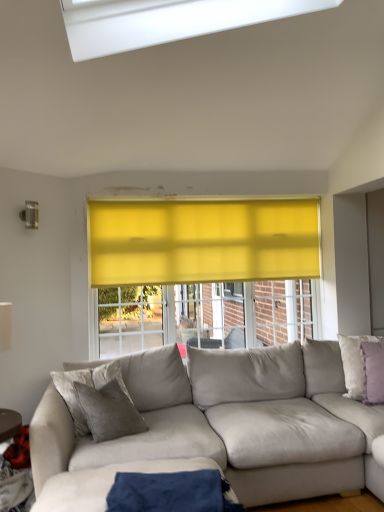
Question: From the image's perspective, is suede beige couch at lower right below white matte table lamp at left?

Choices:
 (A) yes
 (B) no

Answer: (A)

Question: Is suede beige couch at lower right oriented away from white matte table lamp at left?

Choices:
 (A) no
 (B) yes

Answer: (A)

Question: Is suede beige couch at lower right not near white matte table lamp at left?

Choices:
 (A) yes
 (B) no

Answer: (A)

Question: From the image's perspective, is suede beige couch at lower right over white matte table lamp at left?

Choices:
 (A) no
 (B) yes

Answer: (A)

Question: From a real-world perspective, is suede beige couch at lower right physically above white matte table lamp at left?

Choices:
 (A) yes
 (B) no

Answer: (B)

Question: From a real-world perspective, is white matte table lamp at left positioned above or below wooden textured table at lower left?

Choices:
 (A) below
 (B) above

Answer: (B)

Question: Is white matte table lamp at left situated inside wooden textured table at lower left or outside?

Choices:
 (A) inside
 (B) outside

Answer: (B)

Question: From their relative heights in the image, would you say white matte table lamp at left is taller or shorter than wooden textured table at lower left?

Choices:
 (A) short
 (B) tall

Answer: (A)

Question: Is point [x=6, y=347] closer or farther from the camera than point [x=28, y=444]?

Choices:
 (A) closer
 (B) farther

Answer: (B)

Question: In terms of height, does wooden textured table at lower left look taller or shorter compared to purple velvet pillow at right, the 1th pillow viewed from the front?

Choices:
 (A) tall
 (B) short

Answer: (A)

Question: From the image's perspective, is wooden textured table at lower left above or below purple velvet pillow at right, which is counted as the 2th pillow, starting from the back?

Choices:
 (A) above
 (B) below

Answer: (B)

Question: From a real-world perspective, is wooden textured table at lower left physically located above or below purple velvet pillow at right, the 1th pillow viewed from the front?

Choices:
 (A) below
 (B) above

Answer: (A)

Question: Considering the positions of wooden textured table at lower left and purple velvet pillow at right, the 1th pillow viewed from the front, in the image, is wooden textured table at lower left wider or thinner than purple velvet pillow at right, the 1th pillow viewed from the front,?

Choices:
 (A) wide
 (B) thin

Answer: (A)

Question: Is point (370, 368) positioned closer to the camera than point (1, 495)?

Choices:
 (A) farther
 (B) closer

Answer: (A)

Question: Which is correct: purple velvet pillow at right, which is counted as the 2th pillow, starting from the back, is inside wooden textured table at lower left, or outside of it?

Choices:
 (A) outside
 (B) inside

Answer: (A)